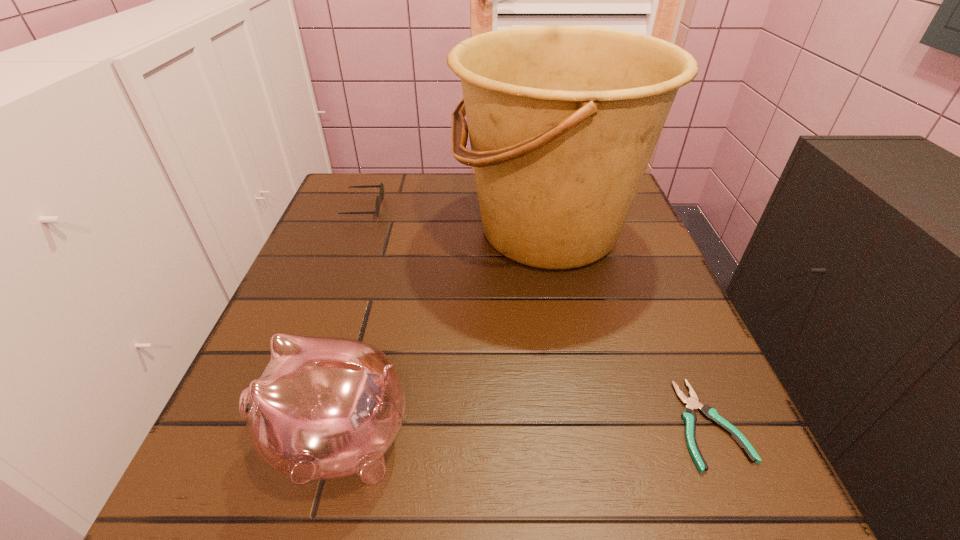
This screenshot has height=540, width=960. What are the coordinates of `free location that satisfies the following two spatial constraints: 1. on the front-facing side of the third tallest object; 2. on the right side of the pliers` in the screenshot? It's located at (283, 424).

Image resolution: width=960 pixels, height=540 pixels. In order to click on free space that satisfies the following two spatial constraints: 1. on the side of the bucket with the handle; 2. on the right side of the shortest object in this screenshot , I will do `click(588, 424)`.

You are a GUI agent. You are given a task and a screenshot of the screen. Output one action in this format:
    pyautogui.click(x=<x>, y=<y>)
    Task: Click on the blank space that satisfies the following two spatial constraints: 1. on the back side of the pliers; 2. on the front-facing side of the sunglasses
    
    Given the screenshot: What is the action you would take?
    pyautogui.click(x=616, y=207)

This screenshot has width=960, height=540. I want to click on vacant position in the image that satisfies the following two spatial constraints: 1. on the front-facing side of the pliers; 2. on the left side of the sunglasses, so click(x=283, y=424).

Image resolution: width=960 pixels, height=540 pixels. Identify the location of free point that satisfies the following two spatial constraints: 1. on the side of the tallest object with the handle; 2. on the left side of the shortest object. pos(588,424).